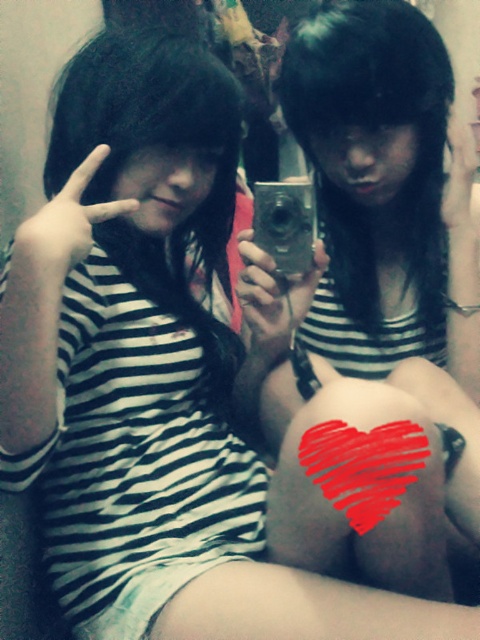
You are trying to decide which object is wider between the matte black camera at center and the red painted heart at center. Based on their positions in the image, which one do you think is wider?

The matte black camera at center is wider than the red painted heart at center according to the description provided.

You are standing in the room and want to place a small plant between the two points, point [436,536] and point [361,452]. Which point should the plant be closer to so that it is in front of the second point?

The plant should be closer to point [361,452] because point [436,536] is behind point [361,452], so placing the plant near point [361,452] ensures it is in front of the second point.

You are standing in the room and see the two people. The camera is at point (x=384, y=195). If you want to take a photo of the person on the left without the camera in the frame, where should you position yourself relative to the camera?

To avoid the matte black camera at center represented by point (x=384, y=195), you should position yourself to the side or behind the camera so that the camera is not in the line of sight when photographing the person on the left.